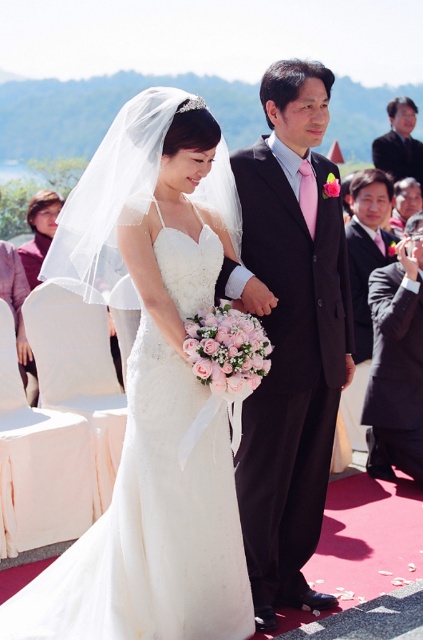
Question: From the image, what is the correct spatial relationship of matte black suit at center in relation to black satin suit at right?

Choices:
 (A) above
 (B) below

Answer: (B)

Question: Does matte black suit at center appear on the right side of white satin dress at center?

Choices:
 (A) yes
 (B) no

Answer: (A)

Question: Estimate the real-world distances between objects in this image. Which object is closer to the matte black suit at center?

Choices:
 (A) dark suit at upper right
 (B) black suit at right
 (C) white satin dress at center
 (D) black satin suit at right

Answer: (C)

Question: Is matte black suit at center positioned before dark suit at upper right?

Choices:
 (A) yes
 (B) no

Answer: (A)

Question: Which object is farther from the camera taking this photo?

Choices:
 (A) white satin dress at center
 (B) black suit at right
 (C) matte black suit at center

Answer: (B)

Question: Which object appears closest to the camera in this image?

Choices:
 (A) dark suit at upper right
 (B) white satin dress at center
 (C) black suit at right

Answer: (B)